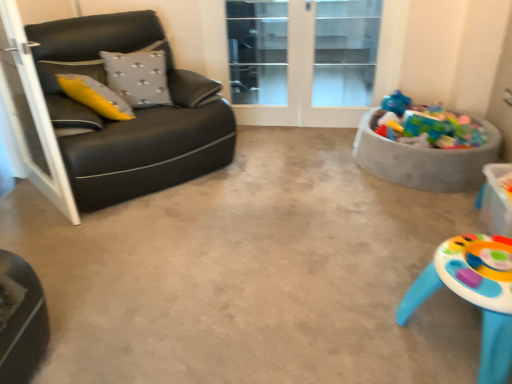
Question: From a real-world perspective, is transparent glass screen door at upper center, which ranks as the first screen door in right-to-left order, above or below transparent glass door at center?

Choices:
 (A) below
 (B) above

Answer: (B)

Question: Is transparent glass screen door at upper center, which ranks as the first screen door in right-to-left order, situated inside transparent glass door at center or outside?

Choices:
 (A) inside
 (B) outside

Answer: (A)

Question: Estimate the real-world distances between objects in this image. Which object is closer to the transparent glass door at center?

Choices:
 (A) matte plastic table at lower right
 (B) black leather couch at left, which is counted as the 2th screen door, starting from the back
 (C) black leather couch at left
 (D) transparent glass screen door at upper center, which ranks as the first screen door in right-to-left order
 (E) gray dotted pillow at upper left

Answer: (D)

Question: Which object is the farthest from the matte plastic table at lower right?

Choices:
 (A) black leather couch at left, placed as the first screen door when sorted from left to right
 (B) gray dotted pillow at upper left
 (C) transparent glass cabinet at upper center
 (D) black leather couch at left
 (E) transparent glass screen door at upper center, which ranks as the first screen door in right-to-left order

Answer: (C)